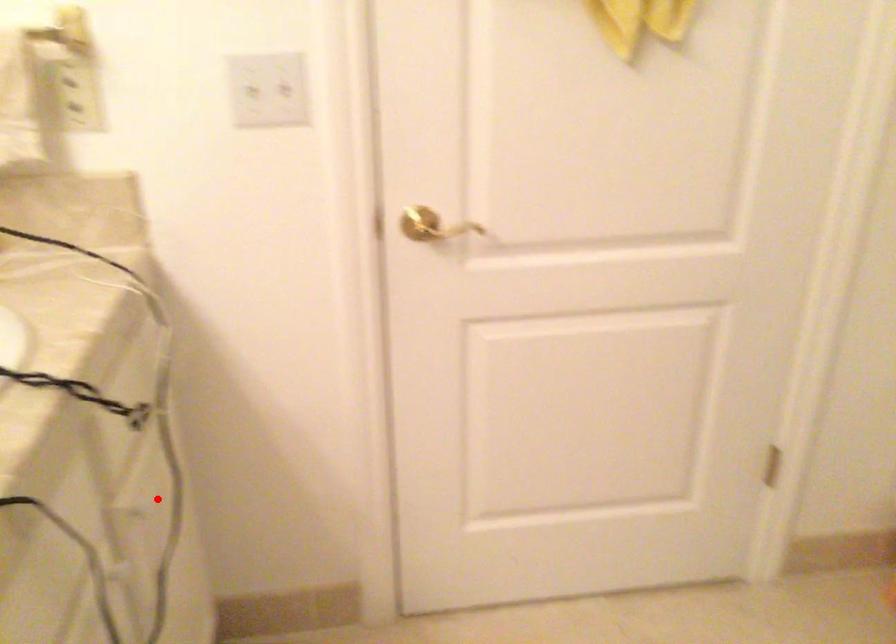
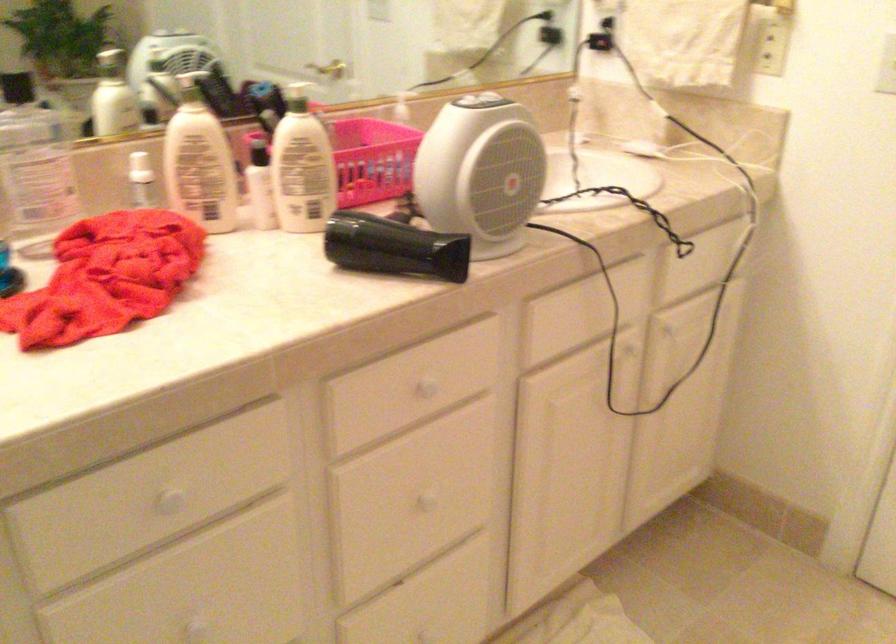
Question: A red point is marked in image1. In image2, is the corresponding 3D point closer to the camera or farther? Reply with the corresponding letter.

Choices:
 (A) The corresponding 3D point is closer.
 (B) The corresponding 3D point is farther.

Answer: (B)